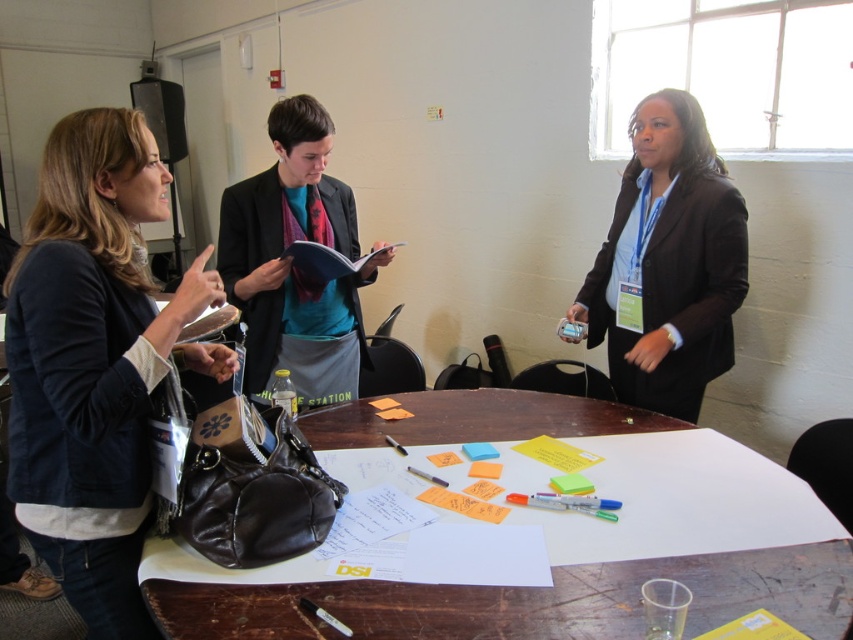
You are a person who is 1.7 meters tall and wants to see the items on the table without bending down. The dark blue leather jacket at left and the black matte blazer at center are on the table. Which item is taller and might block your view?

The dark blue leather jacket at left is taller than the black matte blazer at center, so it might block your view more.

You are a person who is 1.7 meters tall. You are standing in the room and see the brown leather table at center and the black matte blazer at center. Which object is shorter?

The brown leather table at center is shorter than the black matte blazer at center.